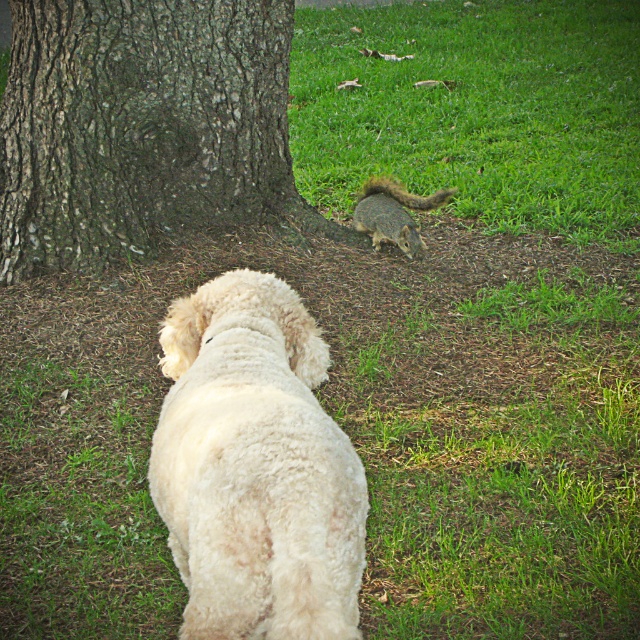
You are standing in the scene and want to reach both the fluffy, light colored dog and the squirrel near the tree trunk. Which of the two points, point (336, 524) or point (403, 204), is closer to you?

Point (336, 524) is closer to the camera than point (403, 204), so the point (336, 524) is closer to you.